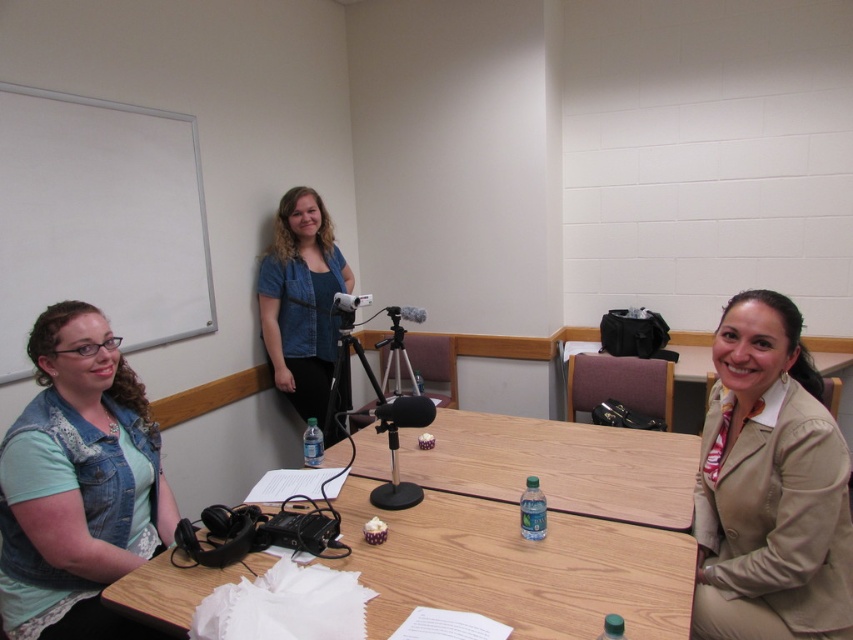
You are organizing a classroom event and need to clear space on the wooden table at lower right. Is the denim jacket at upper center currently occupying space on the table?

Yes, the denim jacket at upper center is positioned over the wooden table at lower right, so it is occupying space on the table and needs to be moved to clear the area.

You are a delivery person who needs to place a package between the denim vest at lower left and the black matte tripod at center. The package is 16 inches long. Can you fit it between them without moving either object?

The denim vest at lower left and the black matte tripod at center are 33.81 inches apart from each other. Since the package is 16 inches long, it can fit between them as the distance between the two objects is greater than the package length.

You are standing at the center of the room facing the whiteboard. Where is the denim vest at lower left relative to your position?

The denim vest at lower left is located at the lower left corner of the room, positioned at coordinates approximately 0.752 on the x and 0.093 on the y axis. Since you are facing the whiteboard, which is on the left wall, the denim vest at lower left would be to your left side near the wall.